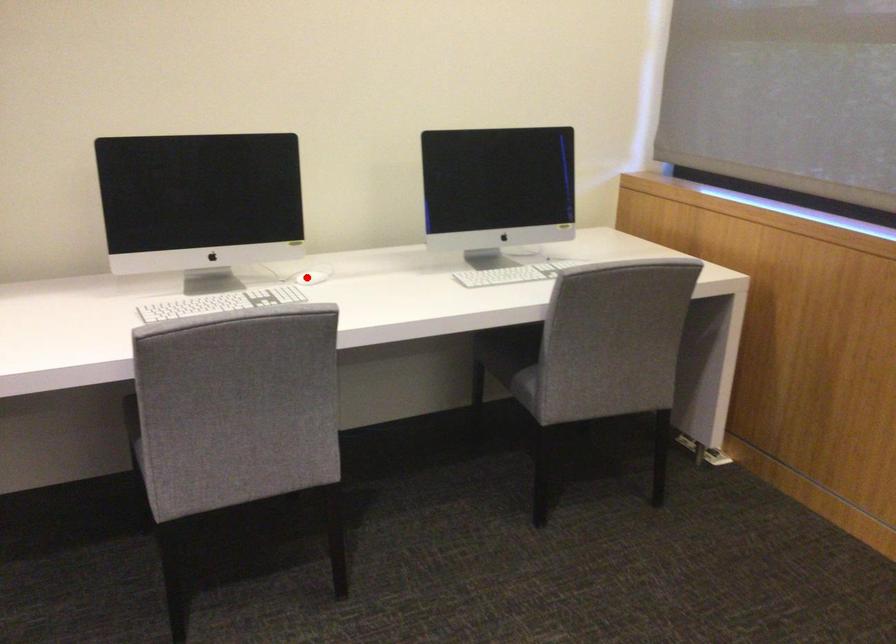
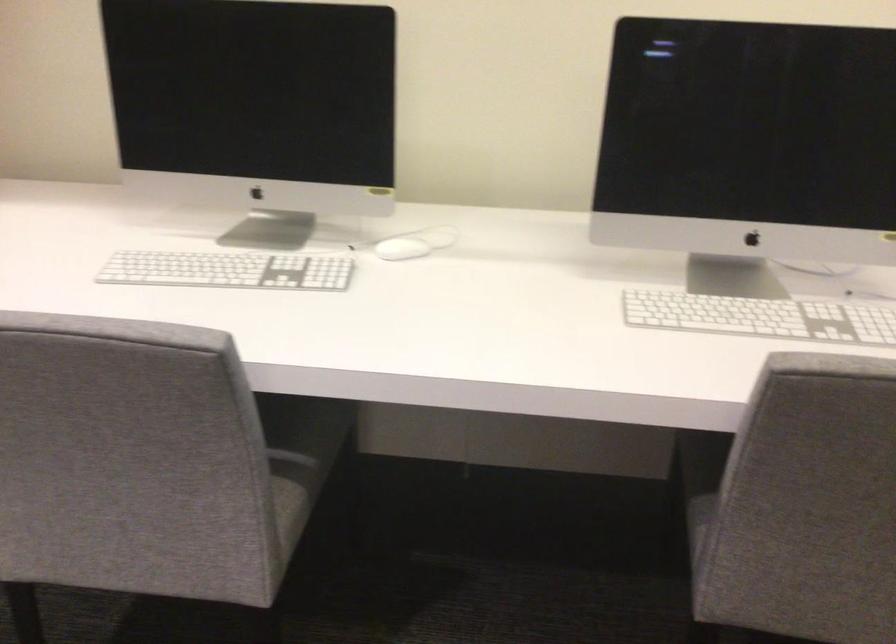
Question: I am providing you with two images of the same scene from different viewpoints. A red point is marked on the first image. Can you still see the location of the red point in image 2?

Choices:
 (A) Yes
 (B) No

Answer: (A)